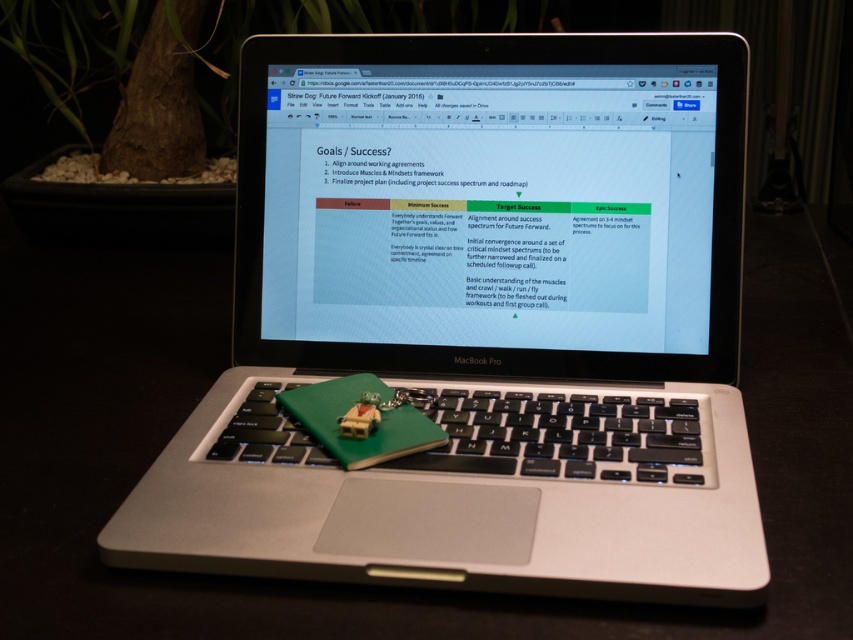
Question: Is silver metallic laptop at center behind satin black screen at center?

Choices:
 (A) yes
 (B) no

Answer: (B)

Question: Among these points, which one is nearest to the camera?

Choices:
 (A) (724, 132)
 (B) (515, 67)

Answer: (A)

Question: Where is silver metallic laptop at center located in relation to satin black screen at center in the image?

Choices:
 (A) above
 (B) below

Answer: (B)

Question: Does silver metallic laptop at center have a lesser width compared to satin black screen at center?

Choices:
 (A) yes
 (B) no

Answer: (B)